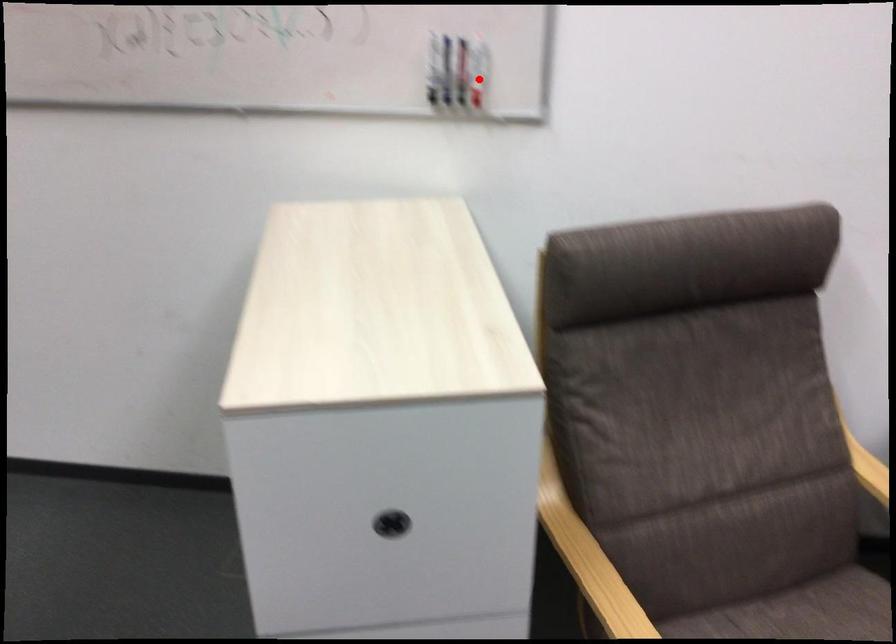
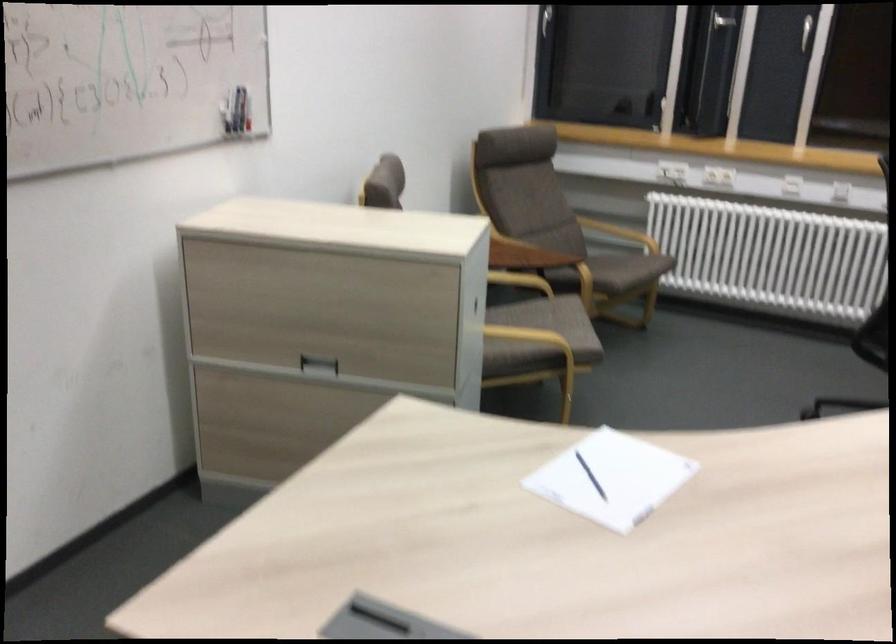
Question: I am providing you with two images of the same scene from different viewpoints. In image1, a red point is highlighted. Considering the same 3D point in image2, which of the following is correct?

Choices:
 (A) It is closer
 (B) It is farther

Answer: (B)